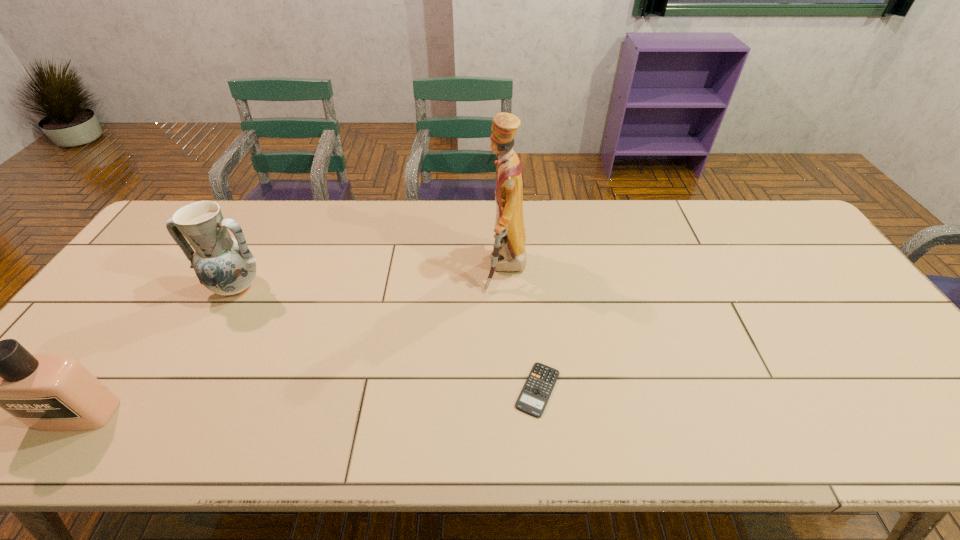
You are a GUI agent. You are given a task and a screenshot of the screen. Output one action in this format:
    pyautogui.click(x=<x>, y=<y>)
    Task: Click on the vacant position in the image that satisfies the following two spatial constraints: 1. on the front-facing side of the nutcracker; 2. on the front label of the perfume
    The height and width of the screenshot is (540, 960).
    Given the screenshot: What is the action you would take?
    514,414

The image size is (960, 540). I want to click on free spot that satisfies the following two spatial constraints: 1. on the front-facing side of the nutcracker; 2. on the front label of the perfume, so [x=514, y=414].

Identify the location of vacant space that satisfies the following two spatial constraints: 1. on either side of the pottery; 2. on the right side of the calculator. This screenshot has height=540, width=960. (181, 389).

Identify the location of vacant space that satisfies the following two spatial constraints: 1. on the front-facing side of the tallest object; 2. on the front label of the perfume. Image resolution: width=960 pixels, height=540 pixels. (514, 414).

The image size is (960, 540). Find the location of `vacant space that satisfies the following two spatial constraints: 1. on the front-facing side of the tallest object; 2. on either side of the third object from right to left`. vacant space that satisfies the following two spatial constraints: 1. on the front-facing side of the tallest object; 2. on either side of the third object from right to left is located at coordinates (506, 287).

This screenshot has width=960, height=540. Find the location of `vacant position in the image that satisfies the following two spatial constraints: 1. on the front-facing side of the tallest object; 2. on either side of the pottery`. vacant position in the image that satisfies the following two spatial constraints: 1. on the front-facing side of the tallest object; 2. on either side of the pottery is located at coordinates (506, 287).

Where is `vacant space that satisfies the following two spatial constraints: 1. on either side of the second object from left to right; 2. on the left side of the calculator`? The image size is (960, 540). vacant space that satisfies the following two spatial constraints: 1. on either side of the second object from left to right; 2. on the left side of the calculator is located at coordinates (181, 389).

You are a GUI agent. You are given a task and a screenshot of the screen. Output one action in this format:
    pyautogui.click(x=<x>, y=<y>)
    Task: Click on the free location that satisfies the following two spatial constraints: 1. on the back side of the shortest object; 2. on the front-facing side of the nutcracker
    
    Given the screenshot: What is the action you would take?
    pyautogui.click(x=525, y=268)

Find the location of a particular element. vacant point that satisfies the following two spatial constraints: 1. on the front-facing side of the shortest object; 2. on the right side of the nutcracker is located at coordinates (513, 389).

Image resolution: width=960 pixels, height=540 pixels. I want to click on blank space that satisfies the following two spatial constraints: 1. on the back side of the calculator; 2. on the front-facing side of the tallest object, so click(x=525, y=268).